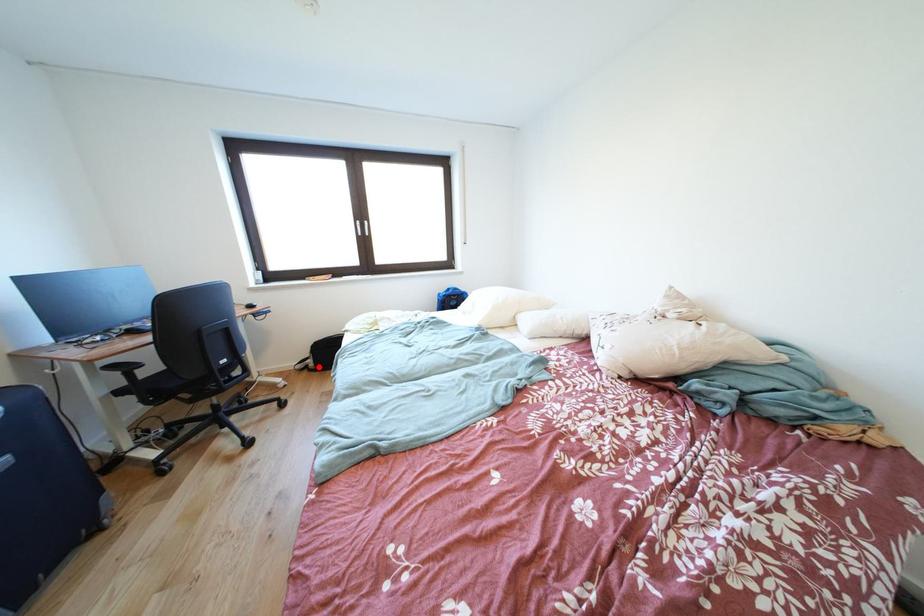
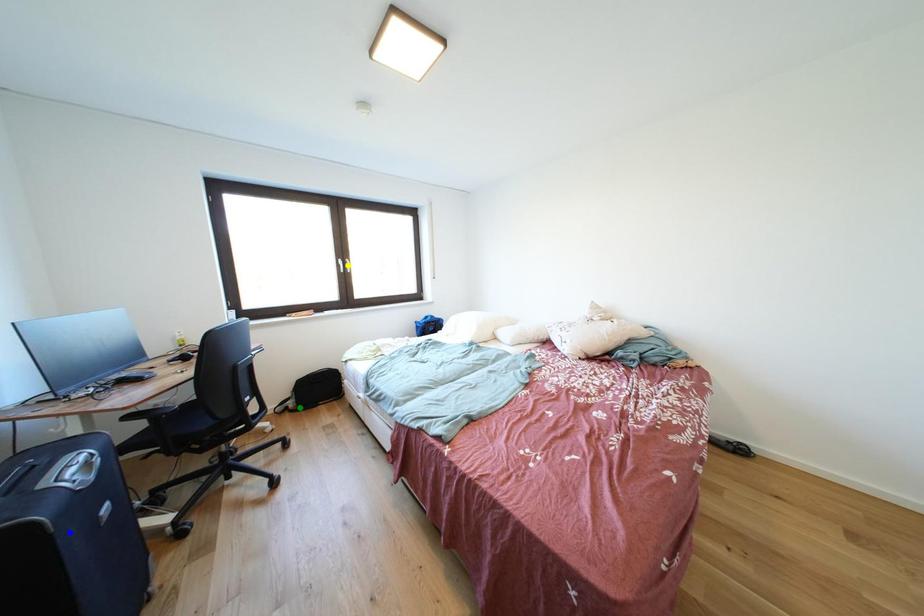
Question: I am providing you with two images of the same scene from different viewpoints. A red point is marked on the first image. You are given multiple points on the second image. Which point in image 2 represents the same 3d spot as the red point in image 1?

Choices:
 (A) blue point
 (B) yellow point
 (C) green point

Answer: (C)